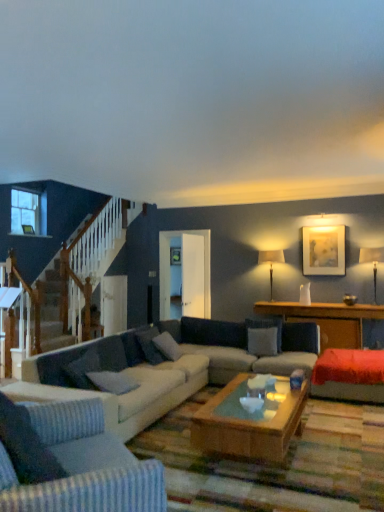
Question: Is gray fabric pillow at center, the 2th pillow viewed from the right, in front of or behind velvet red couch at right in the image?

Choices:
 (A) behind
 (B) front

Answer: (A)

Question: From the image's perspective, is gray fabric pillow at center, which appears as the 3th pillow when viewed from the left, above or below velvet red couch at right?

Choices:
 (A) above
 (B) below

Answer: (A)

Question: Estimate the real-world distances between objects in this image. Which object is closer to the matte white lampshade at upper right, which is the 1th lamp in front-to-back order?

Choices:
 (A) gray fabric pillow at center, the 2th pillow viewed from the right
 (B) wooden coffee table at center
 (C) gray fabric pillow at center, which is counted as the 4th pillow, starting from the left
 (D) matte white lampshade at center-right, which is the first lamp from back to front
 (E) clear glass window at upper left

Answer: (B)

Question: Which object is positioned farthest from the gray fabric pillow at center, which is counted as the 1th pillow, starting from the right?

Choices:
 (A) matte gold picture frame at upper right
 (B) wooden coffee table at center
 (C) light gray fabric couch at lower left, acting as the 1th studio couch starting from the front
 (D) gray fabric pillow at center, the 1th pillow positioned from the left
 (E) matte white lampshade at center-right, which is counted as the first lamp, starting from the left

Answer: (C)